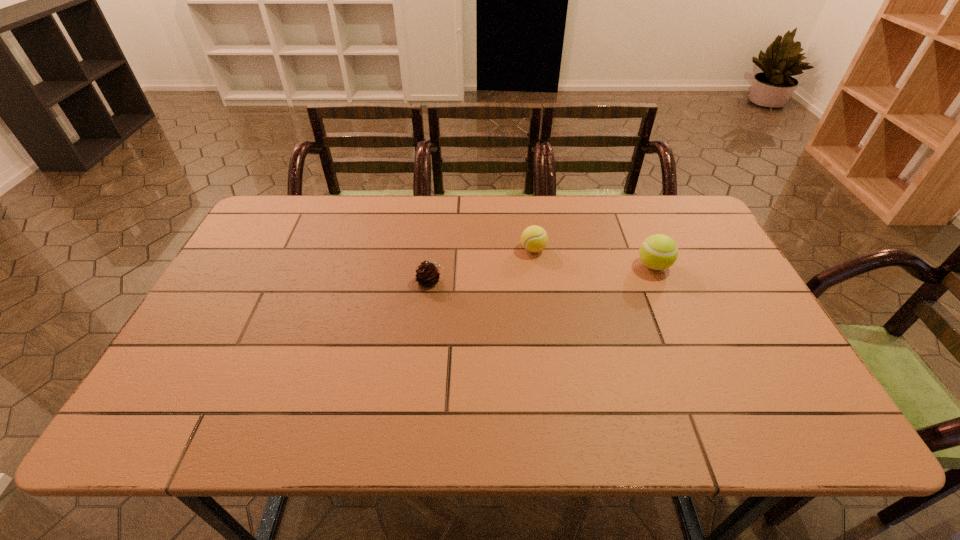
At what (x,y) coordinates should I click in order to perform the action: click on the rightmost object. Please return your answer as a coordinate pair (x, y). This screenshot has height=540, width=960. Looking at the image, I should click on (658, 252).

The image size is (960, 540). What are the coordinates of `the tallest object` in the screenshot? It's located at (658, 252).

What are the coordinates of `the second object from right to left` in the screenshot? It's located at (534, 238).

I want to click on the shorter tennis ball, so click(534, 238).

At what (x,y) coordinates should I click in order to perform the action: click on pinecone. Please return your answer as a coordinate pair (x, y). This screenshot has height=540, width=960. Looking at the image, I should click on (427, 275).

Locate an element on the screen. The image size is (960, 540). vacant space located on the back of the tallest object is located at coordinates (625, 198).

I want to click on vacant region located 0.200m on the back of the second object from right to left, so click(x=527, y=204).

Locate an element on the screen. free space located with a leaf charm attached to the leftmost object is located at coordinates (528, 281).

Locate an element on the screen. This screenshot has height=540, width=960. vacant region at the far edge of the desktop is located at coordinates (579, 234).

Image resolution: width=960 pixels, height=540 pixels. In the image, there is a desktop. In order to click on free region at the near edge in this screenshot , I will do `click(644, 429)`.